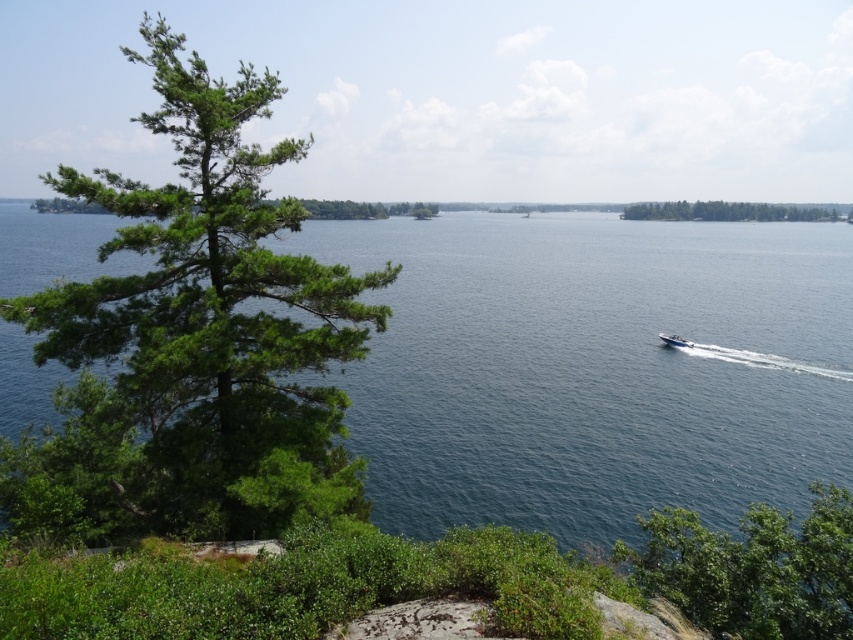
Which is above, green needle-like foliage at left or green leafy tree at upper right?

Positioned higher is green leafy tree at upper right.

Between point (229, 406) and point (793, 208), which one is positioned behind?

The point (793, 208) is more distant.

I want to click on green needle-like foliage at left, so click(x=212, y=321).

Looking at this image, measure the distance between point (x=650, y=520) and camera.

Point (x=650, y=520) and camera are 51.27 feet apart from each other.

Can you confirm if green leafy tree at lower right is bigger than white plastic boat at center-right?

Yes.

Who is more distant from viewer, (730, 540) or (672, 337)?

The point (672, 337) is behind.

Identify the location of green leafy tree at lower right. (753, 568).

How far apart are blue water at center and green leafy tree at lower right?

blue water at center and green leafy tree at lower right are 99.95 meters apart from each other.

Does point (500, 385) lie behind point (850, 536)?

Yes, it is behind point (850, 536).

Locate an element on the screen. blue water at center is located at coordinates (595, 369).